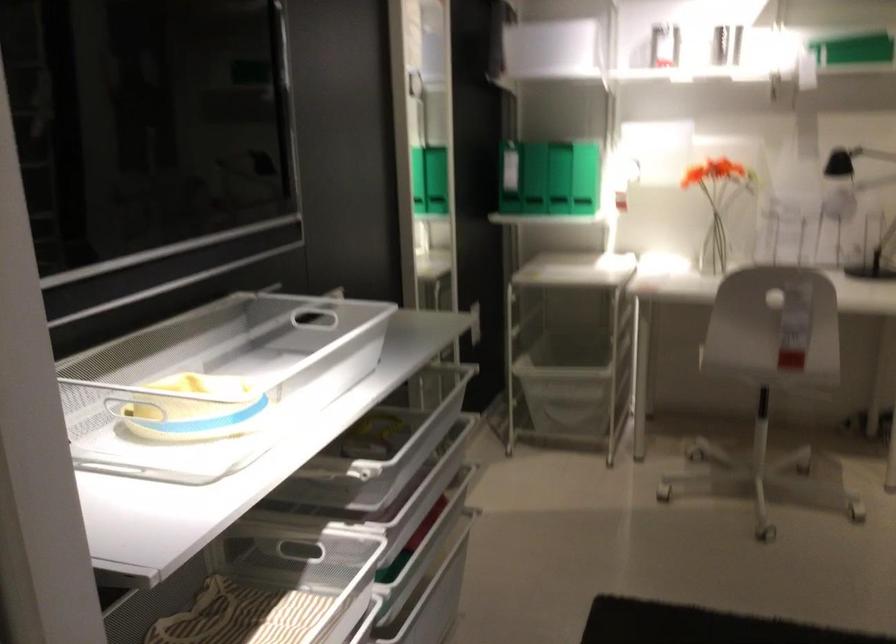
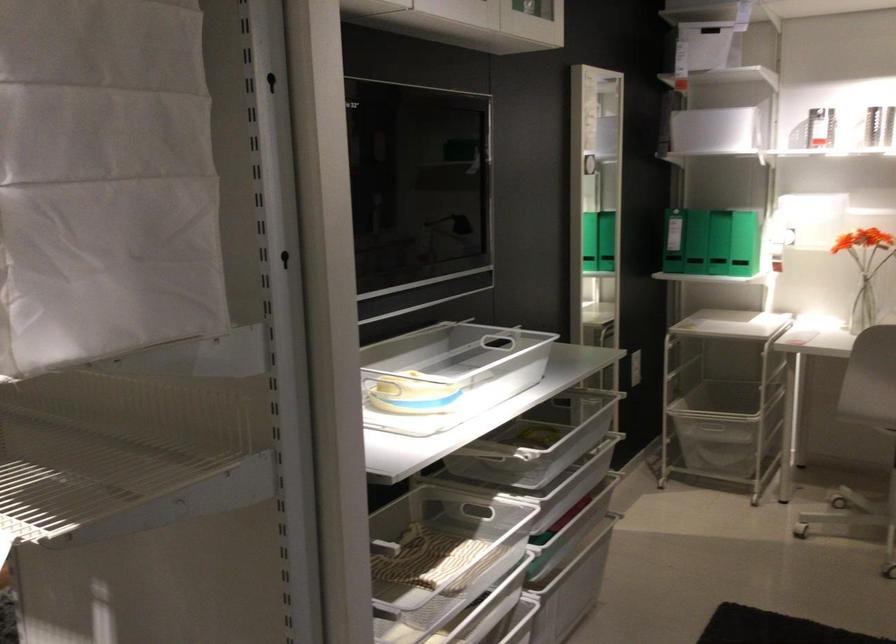
Locate, in the second image, the point that corresponds to point (550, 393) in the first image.

(712, 430)